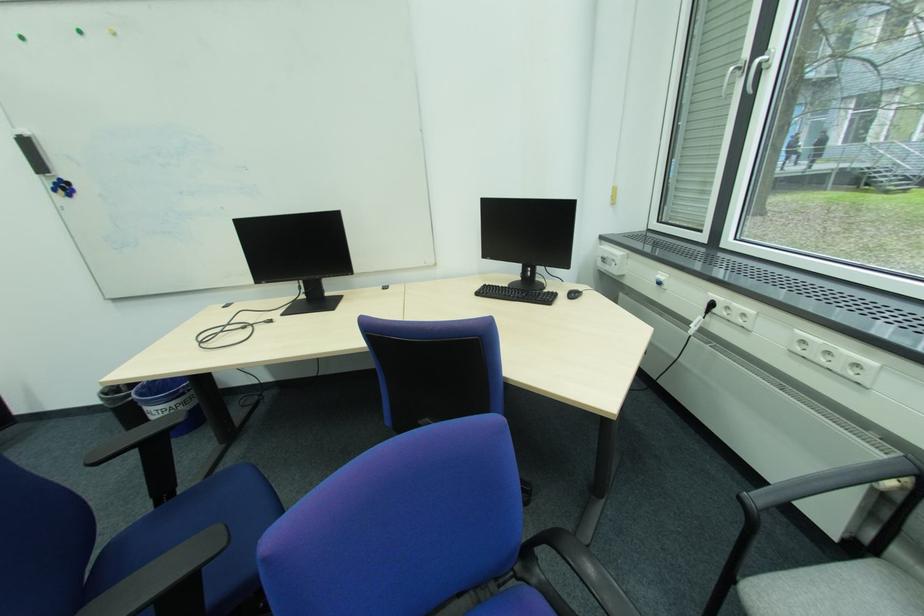
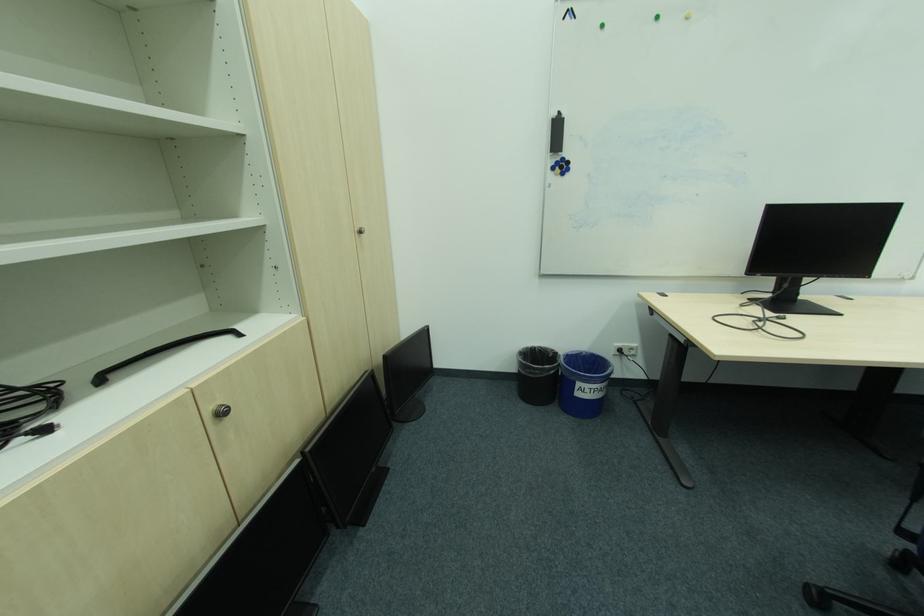
Where in the second image is the point corresponding to (44,174) from the first image?

(558, 152)